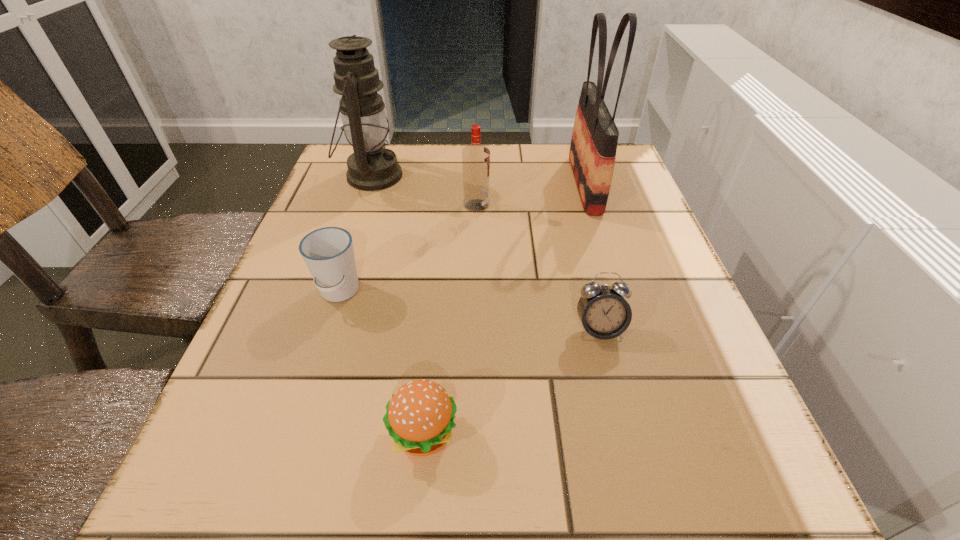
The height and width of the screenshot is (540, 960). In order to click on vacant area that lies between the second nearest object and the cup in this screenshot , I will do `click(469, 311)`.

Find the location of a particular element. The image size is (960, 540). vacant space in between the alarm clock and the cup is located at coordinates (469, 311).

Find the location of `vacant space in between the vodka and the third nearest object`. vacant space in between the vodka and the third nearest object is located at coordinates (408, 249).

This screenshot has width=960, height=540. I want to click on free spot between the third nearest object and the shopping bag, so click(x=462, y=239).

I want to click on vacant area that lies between the vodka and the hamburger, so click(x=450, y=320).

At what (x,y) coordinates should I click in order to perform the action: click on vacant space that is in between the shopping bag and the third tallest object. Please return your answer as a coordinate pair (x, y). The image size is (960, 540). Looking at the image, I should click on (531, 195).

Find the location of a particular element. Image resolution: width=960 pixels, height=540 pixels. unoccupied position between the shortest object and the third tallest object is located at coordinates (450, 320).

You are a GUI agent. You are given a task and a screenshot of the screen. Output one action in this format:
    pyautogui.click(x=<x>, y=<y>)
    Task: Click on the vacant area between the oil lamp and the third tallest object
    
    Given the screenshot: What is the action you would take?
    pyautogui.click(x=424, y=191)

Identify the location of free space that is in between the shopping bag and the cup. This screenshot has width=960, height=540. (462, 239).

The width and height of the screenshot is (960, 540). In order to click on the third closest object to the nearest object in this screenshot , I will do 475,157.